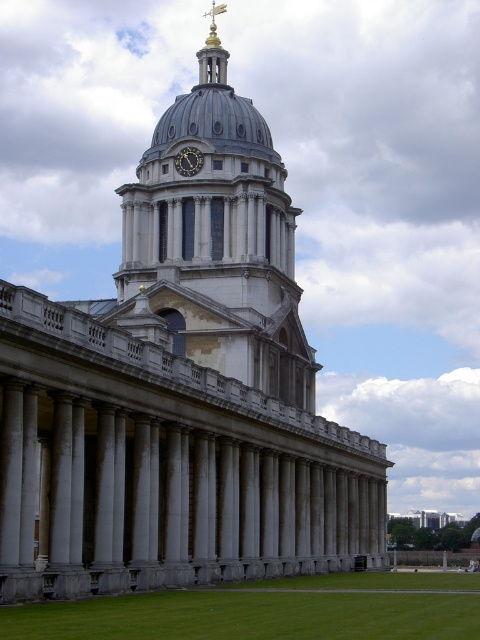
You are standing in front of the building and want to know if the gray stone dome at center can be seen above the green grass at lower center. Can you see it?

The gray stone dome at center has a greater height compared to green grass at lower center, so yes, you can see the gray stone dome at center above the green grass at lower center.

You are standing in front of the building and want to take a photo that includes both the gray stone dome at center and the green grass at lower center. Which object should you focus on first to ensure both are in frame?

You should focus on the gray stone dome at center first because it is closer to you than the green grass at lower center, so adjusting the camera to include it will naturally include the grass in the background.